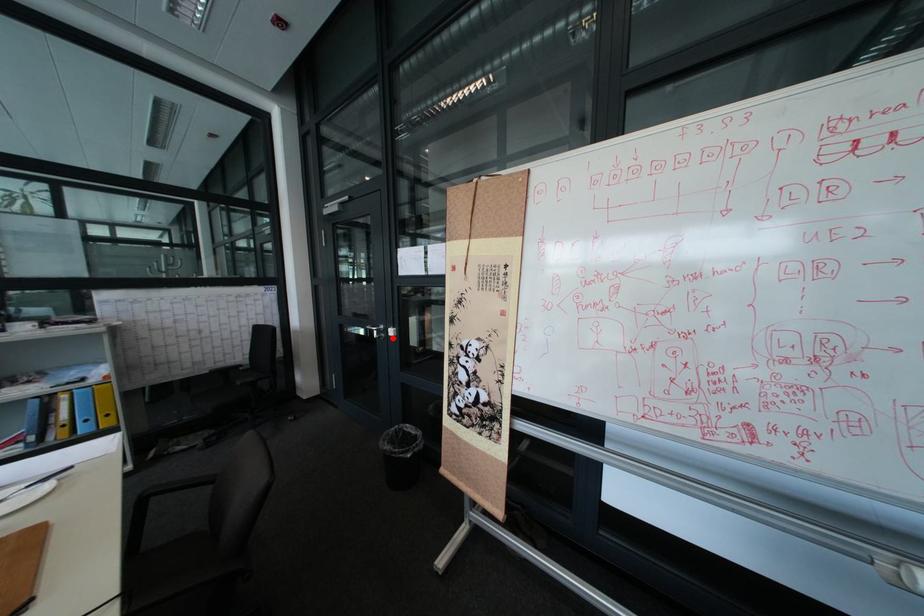
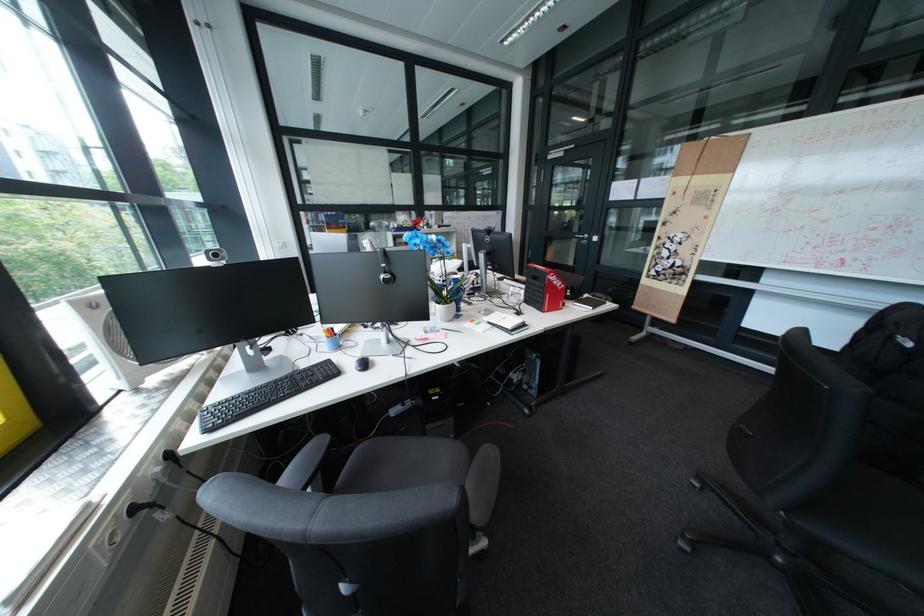
The point at the highlighted location is marked in the first image. Where is the corresponding point in the second image?

(598, 243)